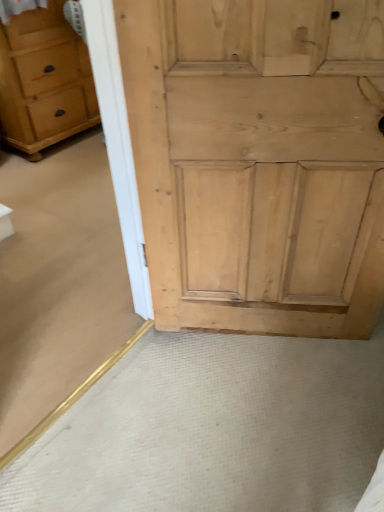
Where is `matte light brown chest of drawers at left`? The width and height of the screenshot is (384, 512). matte light brown chest of drawers at left is located at coordinates (44, 80).

What is the approximate height of matte light brown chest of drawers at left?

35.48 inches.

The width and height of the screenshot is (384, 512). Describe the element at coordinates (44, 80) in the screenshot. I see `matte light brown chest of drawers at left` at that location.

The image size is (384, 512). Find the location of `matte light brown chest of drawers at left`. matte light brown chest of drawers at left is located at coordinates (44, 80).